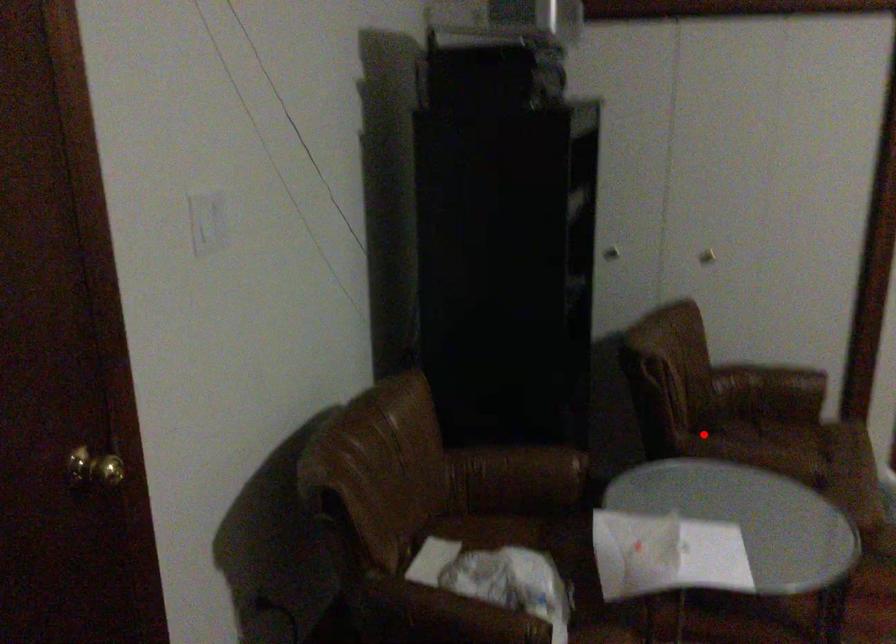
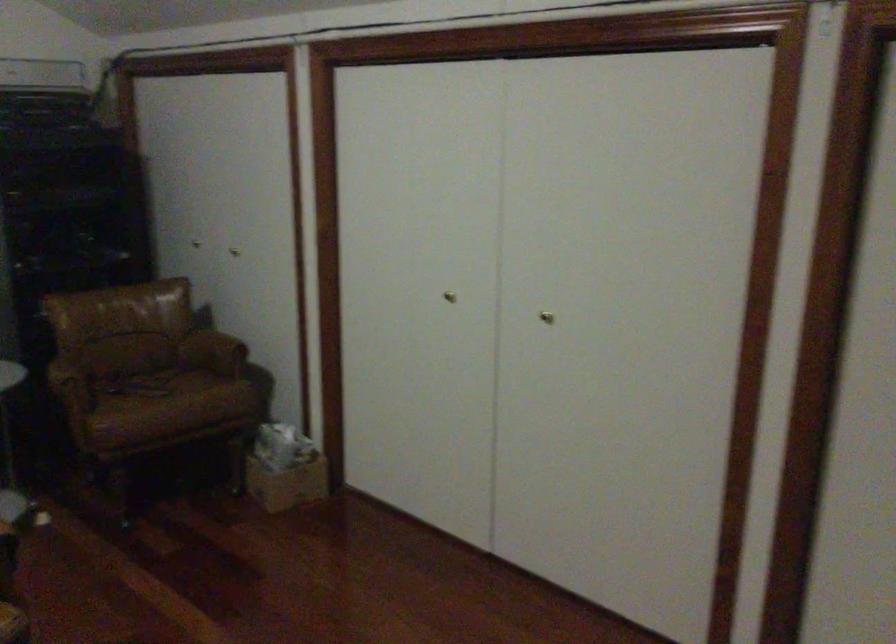
Question: A red point is marked in image1. In image2, is the corresponding 3D point closer to the camera or farther? Reply with the corresponding letter.

Choices:
 (A) The corresponding 3D point is closer.
 (B) The corresponding 3D point is farther.

Answer: (B)